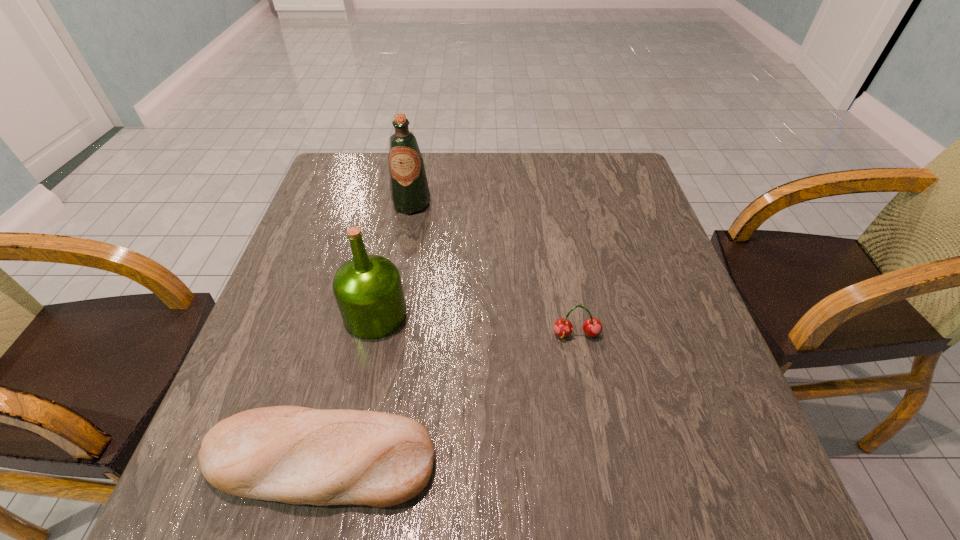
The image size is (960, 540). I want to click on empty location between the farthest object and the cherry, so click(x=493, y=269).

This screenshot has height=540, width=960. I want to click on free space between the nearest object and the nearer olive oil, so click(x=348, y=387).

The height and width of the screenshot is (540, 960). In order to click on free point between the nearest object and the nearer olive oil in this screenshot , I will do `click(348, 387)`.

Identify the location of vacant space in between the farthest object and the rightmost object. (493, 269).

The height and width of the screenshot is (540, 960). Identify the location of free space between the nearest object and the nearer olive oil. (348, 387).

Locate which object ranks in proximity to the bread. Please provide its 2D coordinates. Your answer should be formatted as a tuple, i.e. [(x, y)], where the tuple contains the x and y coordinates of a point satisfying the conditions above.

[(368, 290)]

Point out which object is positioned as the third nearest to the nearer olive oil. Please provide its 2D coordinates. Your answer should be formatted as a tuple, i.e. [(x, y)], where the tuple contains the x and y coordinates of a point satisfying the conditions above.

[(592, 327)]